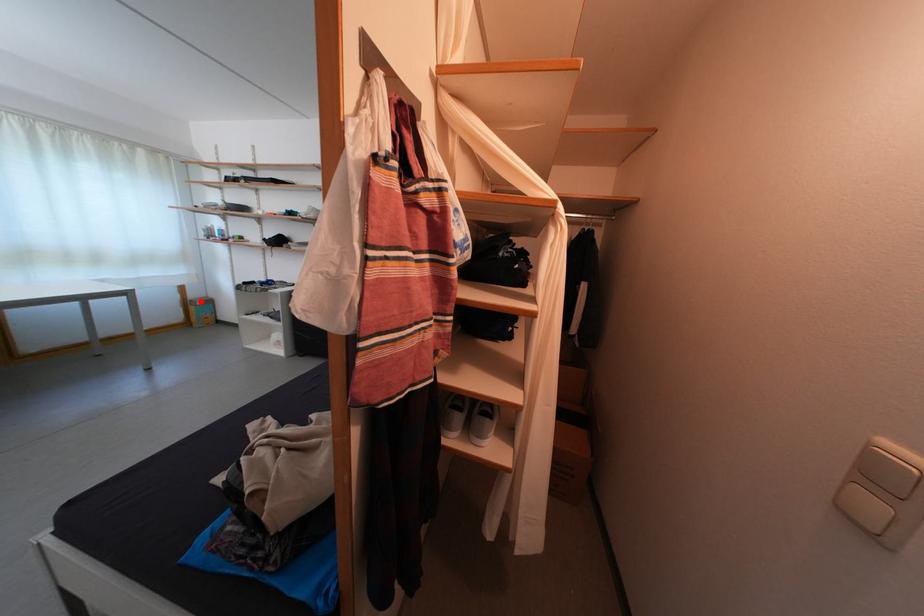
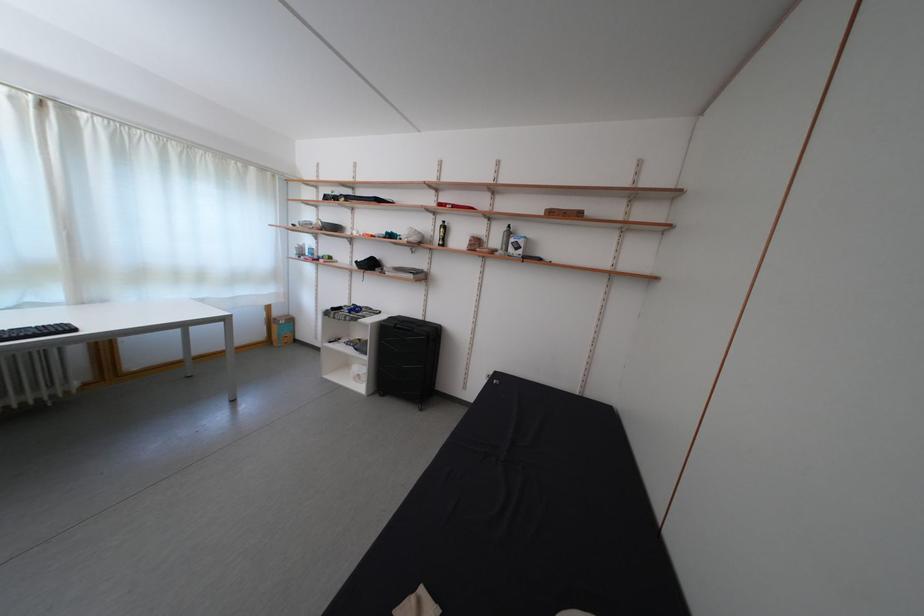
Question: I am providing you with two images of the same scene from different viewpoints. A red point is marked on the first image. At the location where the point appears in image 1, is it still visible in image 2?

Choices:
 (A) Yes
 (B) No

Answer: (A)